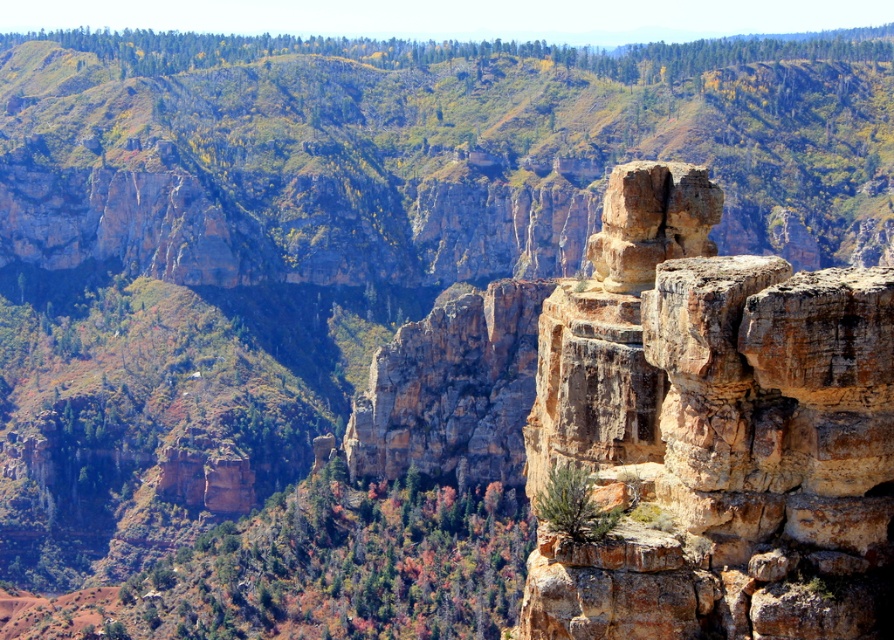
Is rustic stone cliff at center thinner than rusty brown rock at right?

In fact, rustic stone cliff at center might be wider than rusty brown rock at right.

Does rustic stone cliff at center appear under rusty brown rock at right?

No, rustic stone cliff at center is not below rusty brown rock at right.

Who is more distant from viewer, (798, 212) or (628, 392)?

Point (798, 212)

Identify the location of rustic stone cliff at center. This screenshot has height=640, width=894. (423, 150).